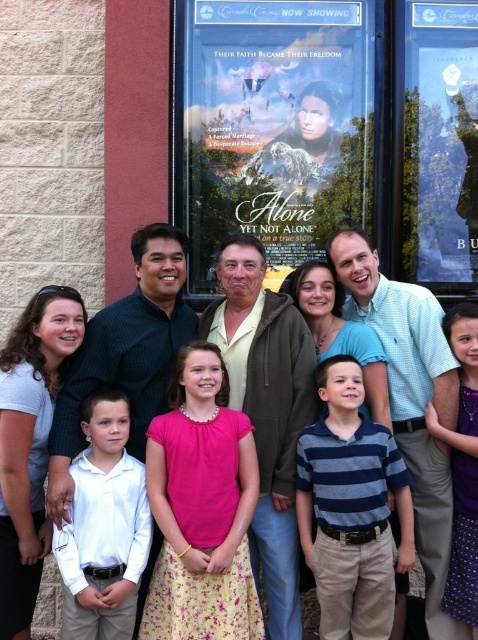
Question: Does matte plastic movie poster at upper center have a smaller size compared to metallic silver poster at upper right?

Choices:
 (A) yes
 (B) no

Answer: (B)

Question: Is white cotton shirt at center wider than metallic silver poster at upper right?

Choices:
 (A) yes
 (B) no

Answer: (A)

Question: Among these objects, which one is nearest to the camera?

Choices:
 (A) metallic silver poster at upper right
 (B) blue striped polo shirt at center
 (C) white cotton shirt at center
 (D) matte plastic movie poster at upper center

Answer: (C)

Question: Which is farther from the blue striped polo shirt at center?

Choices:
 (A) metallic silver poster at upper right
 (B) matte yellow shirt at center

Answer: (A)

Question: Can you confirm if matte yellow shirt at center is positioned to the left of metallic silver poster at upper right?

Choices:
 (A) yes
 (B) no

Answer: (A)

Question: Which of the following is the farthest from the observer?

Choices:
 (A) (419, 161)
 (B) (257, 291)
 (C) (111, 512)

Answer: (A)